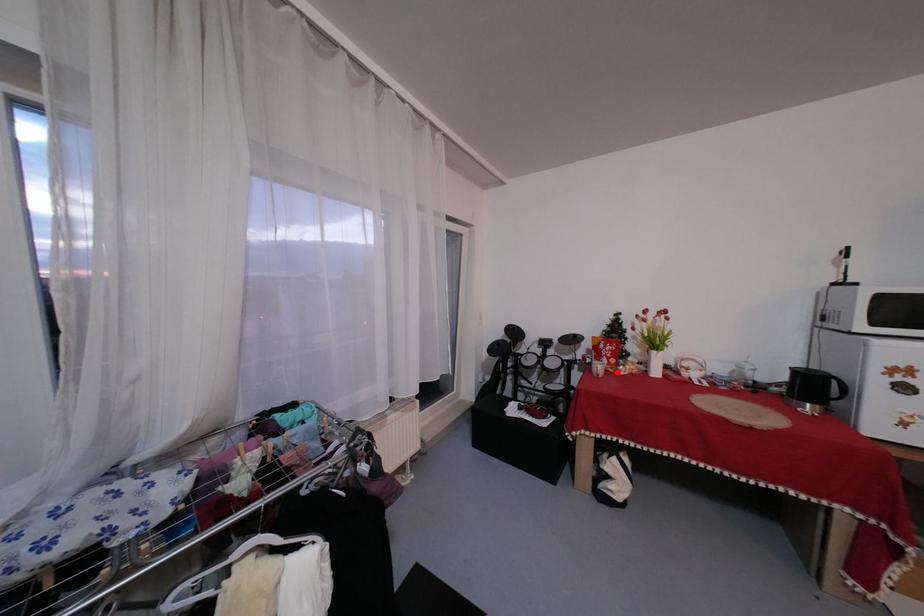
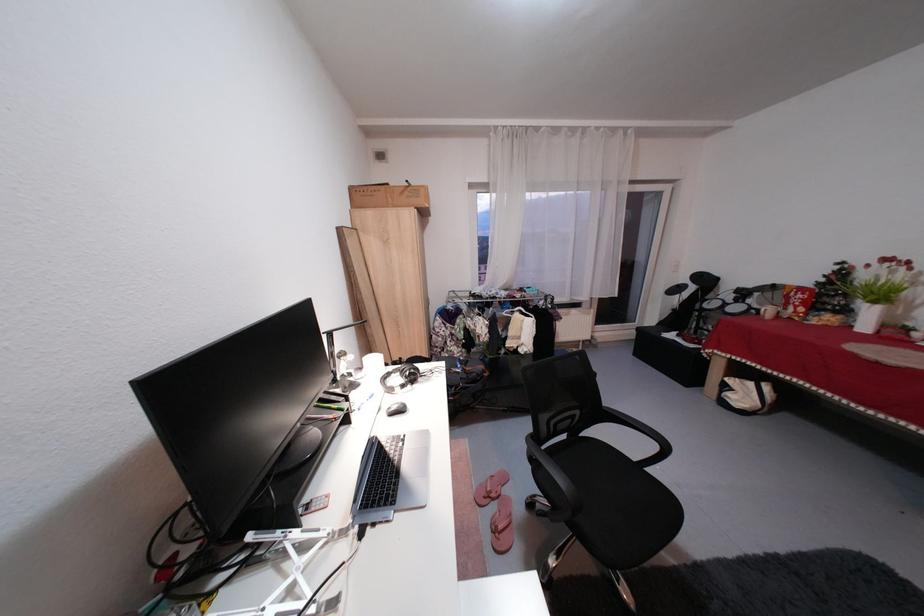
The point at the highlighted location is marked in the first image. Where is the corresponding point in the second image?

(800, 320)